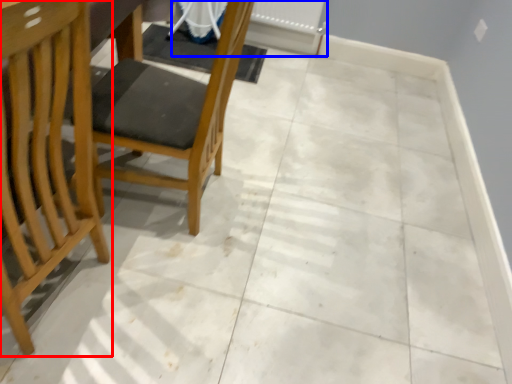
Question: Which object is closer to the camera taking this photo, chair (highlighted by a red box) or radiator (highlighted by a blue box)?

Choices:
 (A) chair
 (B) radiator

Answer: (A)